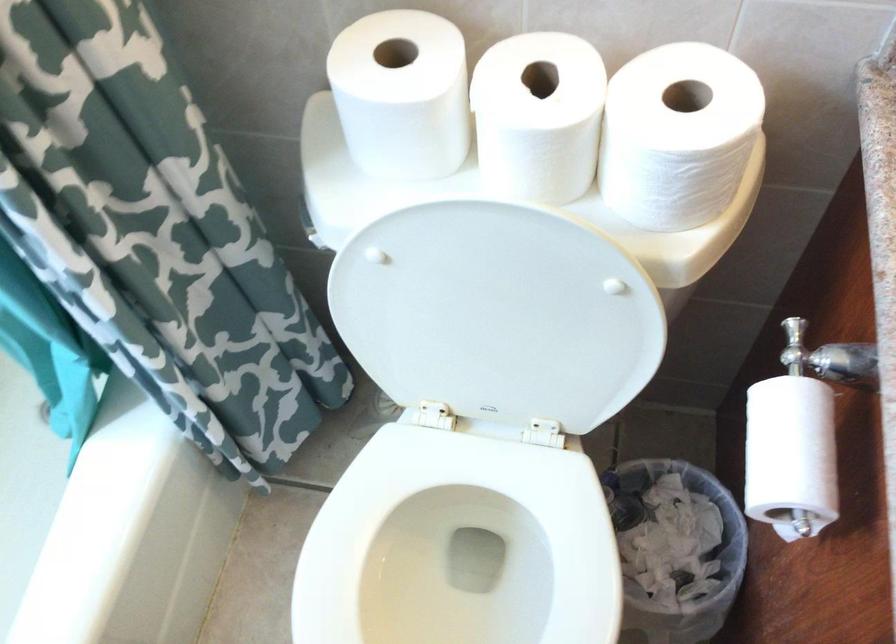
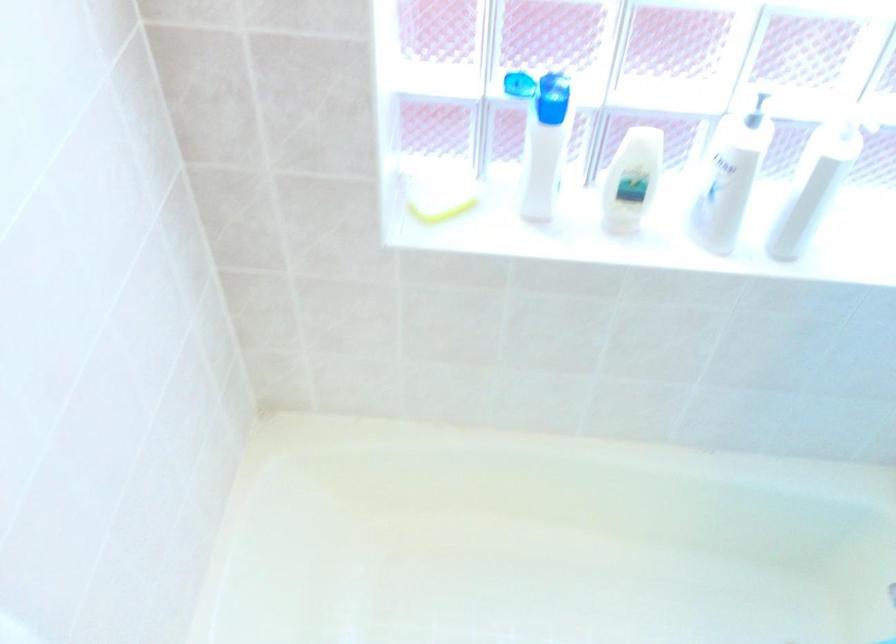
How did the camera likely rotate?

The rotation direction of the camera is left-down.